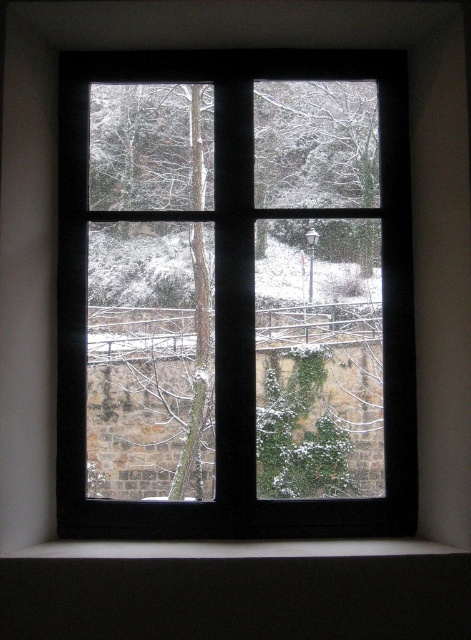
Does black wood window at center appear under white matte window sill at lower center?

No, black wood window at center is not below white matte window sill at lower center.

Locate an element on the screen. Image resolution: width=471 pixels, height=640 pixels. black wood window at center is located at coordinates (235, 296).